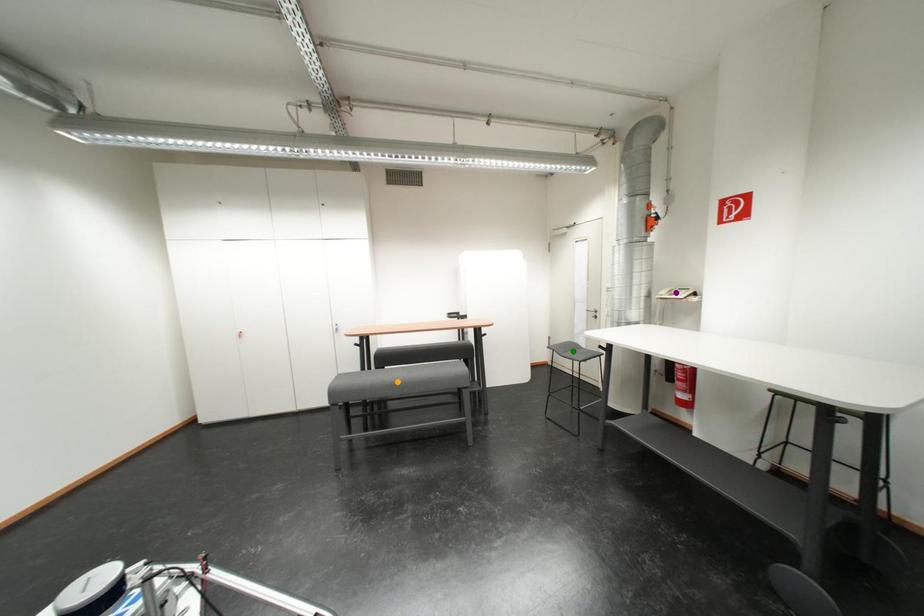
Order these from nearest to farthest:
purple point | green point | orange point

1. purple point
2. orange point
3. green point